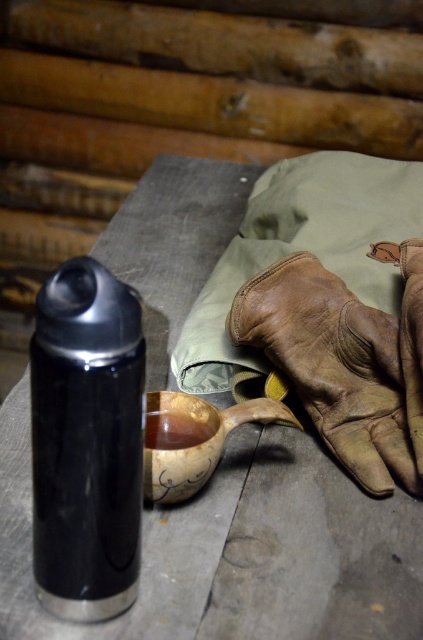
Question: Can you confirm if brown leather glove at center is bigger than green canvas cloth at upper right?

Choices:
 (A) no
 (B) yes

Answer: (A)

Question: Which of the following is the farthest from the observer?

Choices:
 (A) shiny metallic bottle at center
 (B) wooden carved cup at center
 (C) brown wooden bowl at center
 (D) green canvas cloth at upper right

Answer: (D)

Question: Can you confirm if brown leather glove at center is wider than brown wooden bowl at center?

Choices:
 (A) yes
 (B) no

Answer: (A)

Question: Which is nearer to the green canvas cloth at upper right?

Choices:
 (A) brown leather glove at center
 (B) shiny metallic bottle at center
 (C) brown wooden bowl at center

Answer: (A)

Question: Estimate the real-world distances between objects in this image. Which object is closer to the wooden carved cup at center?

Choices:
 (A) brown leather glove at center
 (B) green canvas cloth at upper right
 (C) brown wooden bowl at center

Answer: (C)

Question: Does brown leather glove at center appear over brown wooden bowl at center?

Choices:
 (A) no
 (B) yes

Answer: (B)